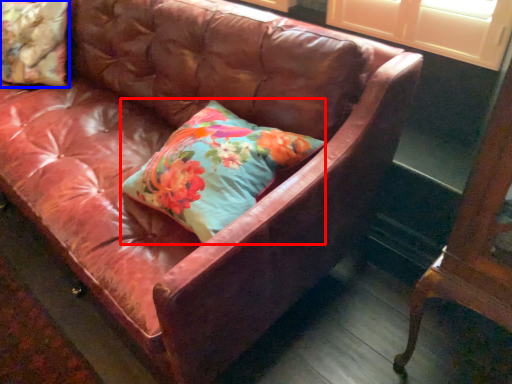
Question: Among these objects, which one is farthest to the camera, pillow (highlighted by a red box) or pillow (highlighted by a blue box)?

Choices:
 (A) pillow
 (B) pillow

Answer: (B)